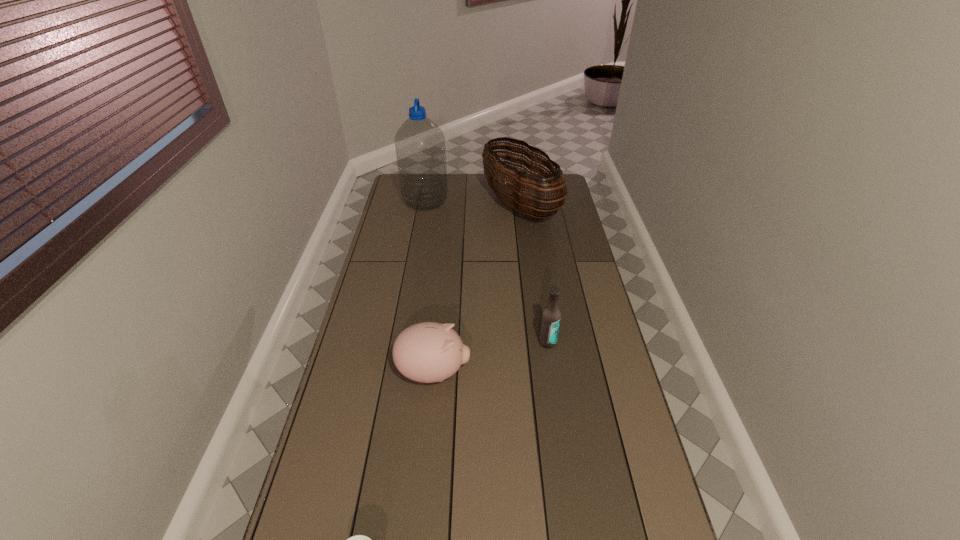
Locate an element on the screen. Image resolution: width=960 pixels, height=540 pixels. basket at the far edge is located at coordinates (523, 199).

The width and height of the screenshot is (960, 540). I want to click on object located in the left edge section of the desktop, so click(420, 148).

This screenshot has width=960, height=540. Find the location of `object situated at the right edge`. object situated at the right edge is located at coordinates (523, 199).

The height and width of the screenshot is (540, 960). I want to click on object that is positioned at the far left corner, so click(420, 148).

The image size is (960, 540). In order to click on object at the far right corner in this screenshot , I will do `click(523, 199)`.

This screenshot has height=540, width=960. In order to click on vacant position at the far edge of the desktop in this screenshot , I will do `click(466, 187)`.

The width and height of the screenshot is (960, 540). Find the location of `free space at the left edge of the desktop`. free space at the left edge of the desktop is located at coordinates (401, 308).

In the image, there is a desktop. Identify the location of vacant space at the right edge. (564, 316).

Locate an element on the screen. empty space that is in between the water jug and the beer bottle is located at coordinates (487, 272).

Find the location of a particular element. vacant area that lies between the water jug and the beer bottle is located at coordinates (487, 272).